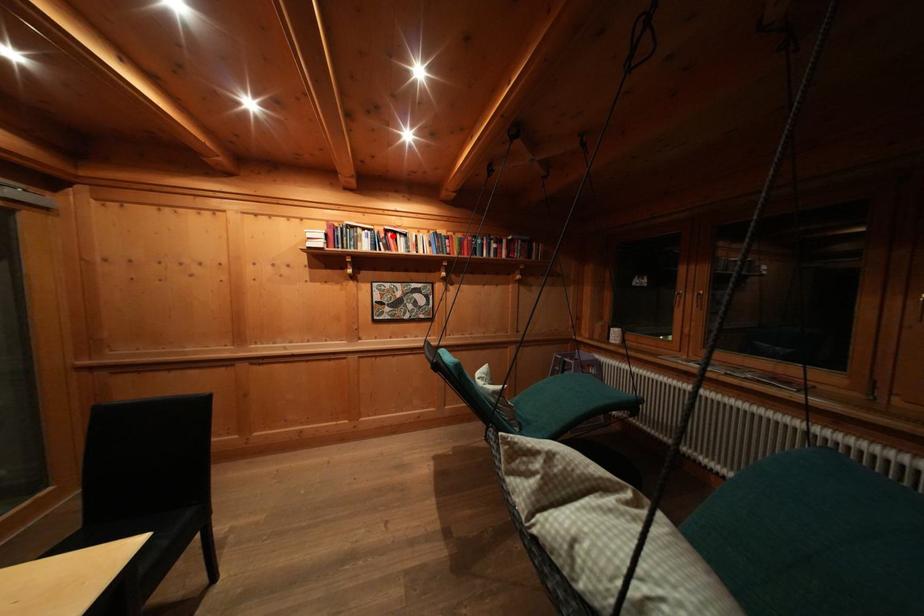
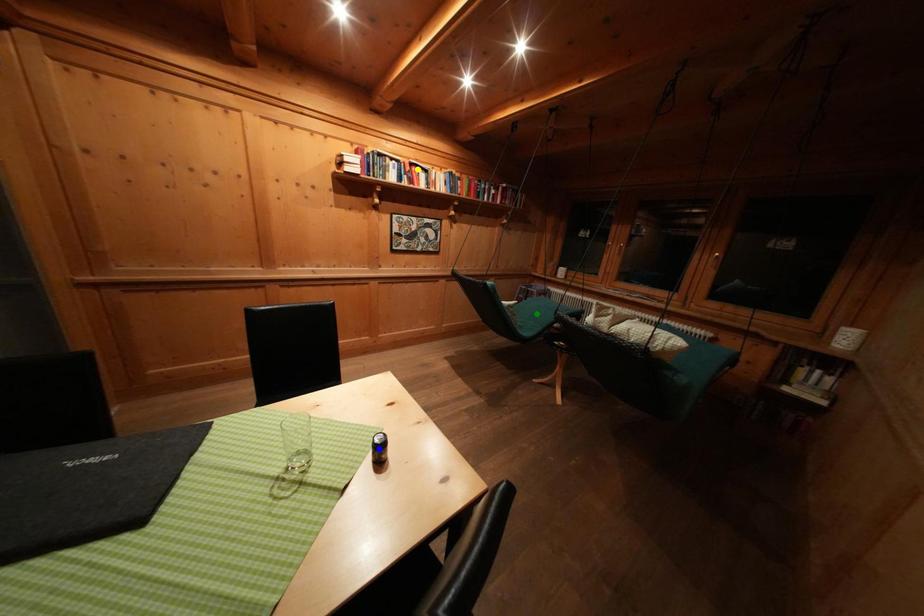
Question: I am providing you with two images of the same scene from different viewpoints. A red point is marked on the first image. You are given multiple points on the second image. In image 2, which mark is for the same physical point as the one in image 1?

Choices:
 (A) yellow point
 (B) green point
 (C) blue point

Answer: (A)